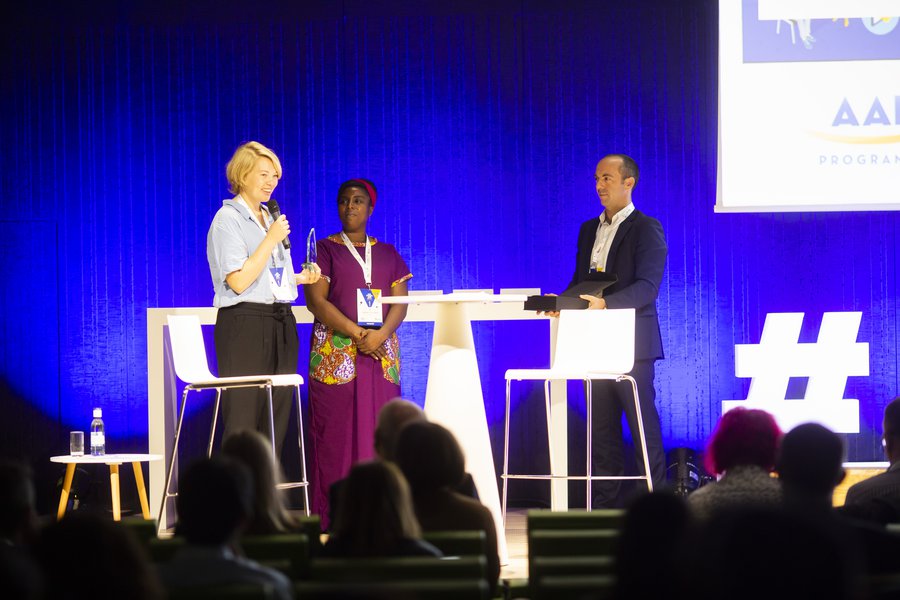
Locate an element on the screen. table is located at coordinates (452, 299).